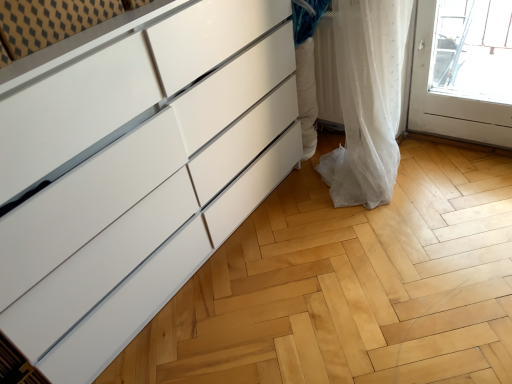
Question: Based on their sizes in the image, would you say white glossy chest of drawers at left is bigger or smaller than white sheer curtain at lower right?

Choices:
 (A) big
 (B) small

Answer: (A)

Question: From a real-world perspective, is white glossy chest of drawers at left physically located above or below white sheer curtain at lower right?

Choices:
 (A) below
 (B) above

Answer: (B)

Question: Is white glossy chest of drawers at left taller or shorter than white sheer curtain at lower right?

Choices:
 (A) tall
 (B) short

Answer: (A)

Question: In terms of height, does white sheer curtain at lower right look taller or shorter compared to white glossy chest of drawers at left?

Choices:
 (A) tall
 (B) short

Answer: (B)

Question: From the image's perspective, is white sheer curtain at lower right above or below white glossy chest of drawers at left?

Choices:
 (A) above
 (B) below

Answer: (A)

Question: Is white sheer curtain at lower right bigger or smaller than white glossy chest of drawers at left?

Choices:
 (A) big
 (B) small

Answer: (B)

Question: Considering their positions, is white sheer curtain at lower right located in front of or behind white glossy chest of drawers at left?

Choices:
 (A) front
 (B) behind

Answer: (B)